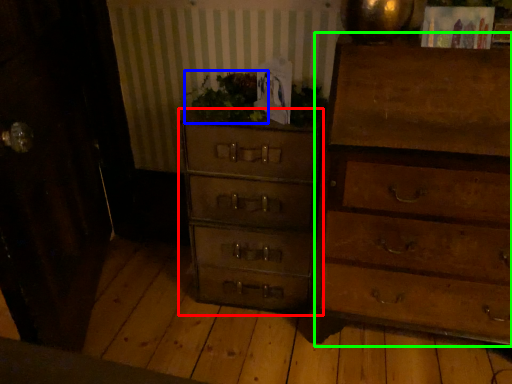
Question: Considering the real-world distances, which object is closest to chest of drawers (highlighted by a red box)? houseplant (highlighted by a blue box) or chest of drawers (highlighted by a green box).

Choices:
 (A) houseplant
 (B) chest of drawers

Answer: (A)